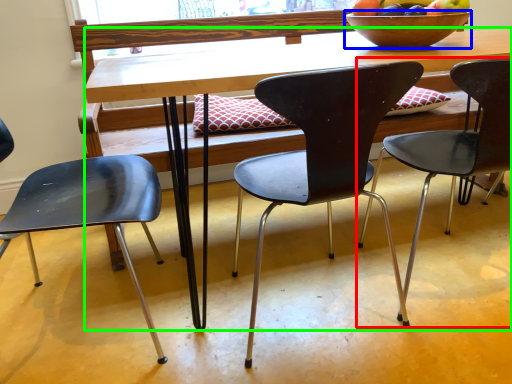
Question: Considering the real-world distances, which object is farthest from chair (highlighted by a red box)? bowl (highlighted by a blue box) or desk (highlighted by a green box)?

Choices:
 (A) bowl
 (B) desk

Answer: (B)